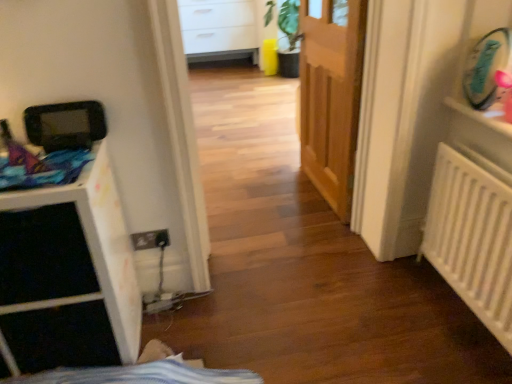
You are a GUI agent. You are given a task and a screenshot of the screen. Output one action in this format:
    pyautogui.click(x=<x>, y=<y>)
    Task: Click on the free location to the left of white matte radiator at right
    
    Given the screenshot: What is the action you would take?
    coord(380,314)